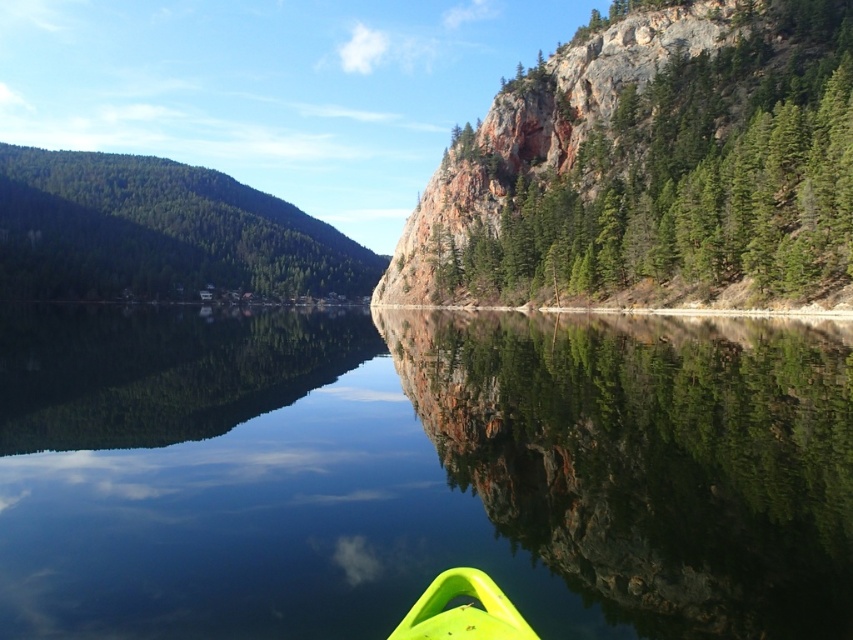
Question: Which object is closer to the camera taking this photo?

Choices:
 (A) green matte forest at left
 (B) green textured rock at upper right
 (C) transparent water at center

Answer: (C)

Question: Is green matte forest at left thinner than neon yellow plastic kayak at lower center?

Choices:
 (A) yes
 (B) no

Answer: (B)

Question: Which point is closer to the camera?

Choices:
 (A) (108, 188)
 (B) (463, 620)
 (C) (693, 88)

Answer: (B)

Question: Is transparent water at center to the left of green matte forest at left from the viewer's perspective?

Choices:
 (A) no
 (B) yes

Answer: (A)

Question: Is green matte forest at left closer to the viewer compared to neon yellow plastic kayak at lower center?

Choices:
 (A) no
 (B) yes

Answer: (A)

Question: Among these objects, which one is nearest to the camera?

Choices:
 (A) transparent water at center
 (B) green textured rock at upper right
 (C) neon yellow plastic kayak at lower center
 (D) green matte forest at left

Answer: (C)